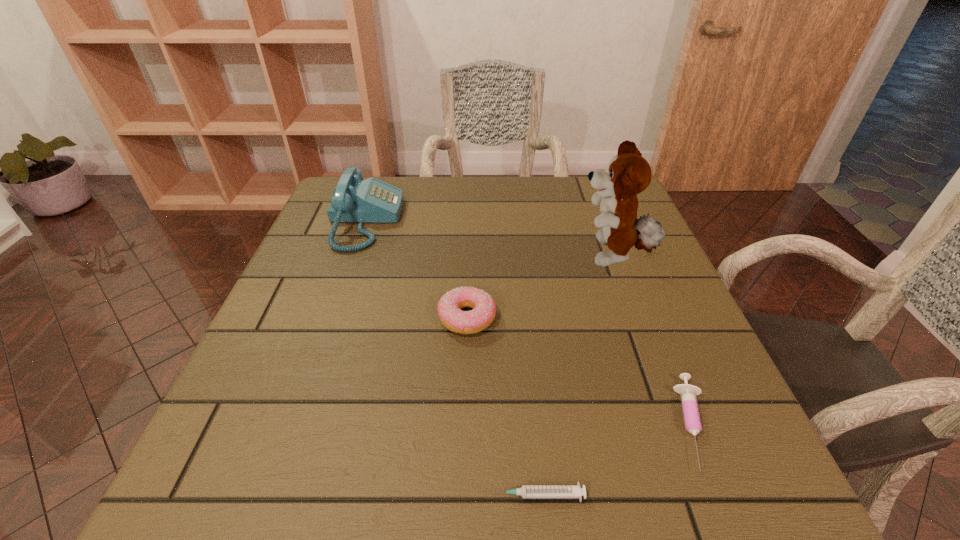
Identify the location of the tallest object. The image size is (960, 540). (628, 173).

At what (x,y) coordinates should I click in order to perform the action: click on the second tallest object. Please return your answer as a coordinate pair (x, y). Image resolution: width=960 pixels, height=540 pixels. Looking at the image, I should click on (354, 200).

Where is `the leftmost object`? The image size is (960, 540). the leftmost object is located at coordinates (354, 200).

Locate an element on the screen. This screenshot has height=540, width=960. doughnut is located at coordinates (450, 314).

This screenshot has width=960, height=540. I want to click on the third nearest object, so click(450, 314).

This screenshot has width=960, height=540. Find the location of `the taller syringe`. the taller syringe is located at coordinates (692, 421).

Find the location of a particular element. The image size is (960, 540). the right syringe is located at coordinates tap(692, 421).

At what (x,y) coordinates should I click in order to perform the action: click on the shorter syringe. Please return your answer as a coordinate pair (x, y). The width and height of the screenshot is (960, 540). Looking at the image, I should click on (526, 491).

Locate an element on the screen. The image size is (960, 540). the nearer syringe is located at coordinates (526, 491).

Find the location of `free space located on the face of the tallest object`. free space located on the face of the tallest object is located at coordinates 541,257.